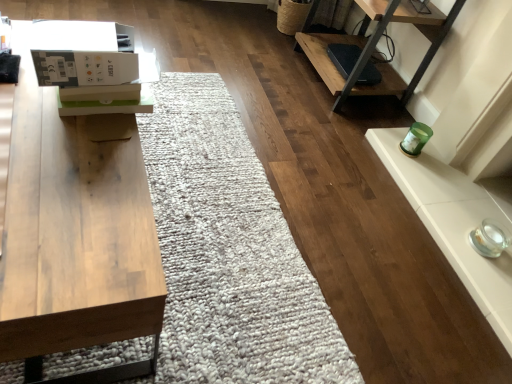
Find the location of a particular element. The width and height of the screenshot is (512, 384). vacant space to the right of wooden table at left is located at coordinates (230, 273).